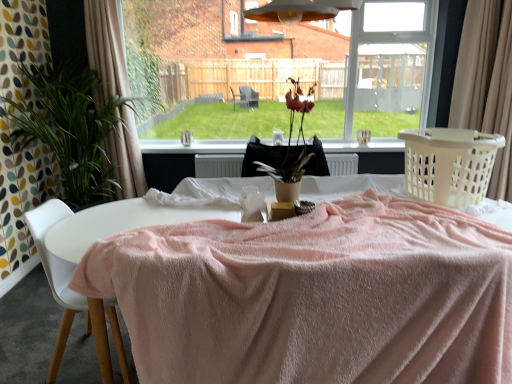
Question: In the image, is green leafy plant at left positioned in front of or behind beige fabric curtain at left, placed as the first curtain when sorted from left to right?

Choices:
 (A) front
 (B) behind

Answer: (A)

Question: From a real-world perspective, is green leafy plant at left physically located above or below beige fabric curtain at left, placed as the first curtain when sorted from left to right?

Choices:
 (A) above
 (B) below

Answer: (B)

Question: Considering the real-world distances, which object is closest to the white plastic laundry basket at upper right?

Choices:
 (A) green leafy plant at left
 (B) transparent glass window at center
 (C) black fabric at center
 (D) white plastic chair at lower left
 (E) beige fabric curtain at right, which is the 1th curtain from right to left

Answer: (E)

Question: Considering the real-world distances, which object is farthest from the white smooth table at center?

Choices:
 (A) beige fabric curtain at right, which ranks as the second curtain in left-to-right order
 (B) green leafy plant at left
 (C) white plastic laundry basket at upper right
 (D) matte brown vase at center
 (E) white plastic chair at lower left

Answer: (A)